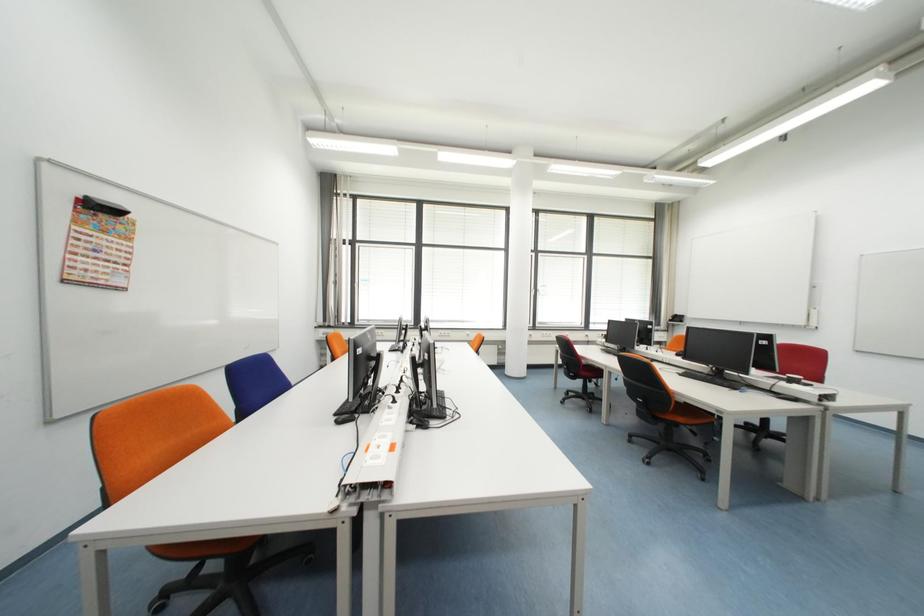
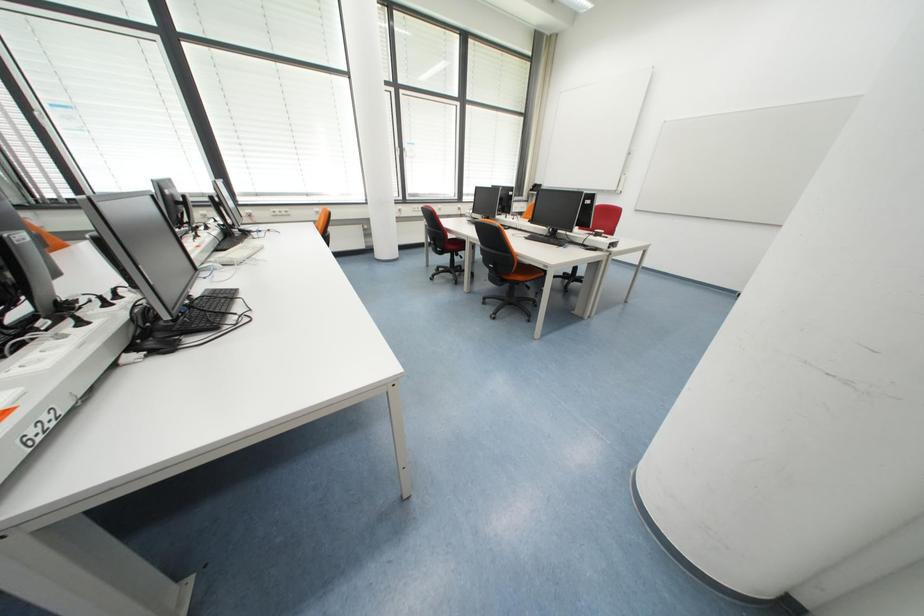
Based on the continuous images, in which direction is the camera rotating?

The rotation direction of the camera is right-down.